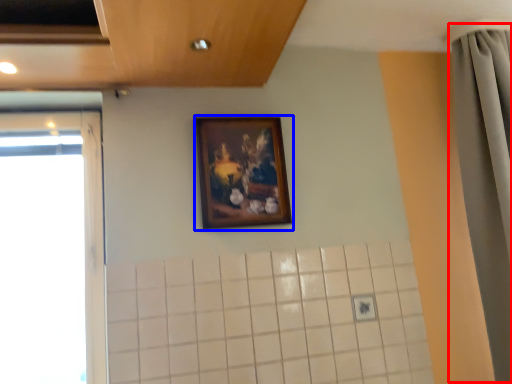
Question: Which of the following is the closest to the observer, shower curtain (highlighted by a red box) or picture frame (highlighted by a blue box)?

Choices:
 (A) shower curtain
 (B) picture frame

Answer: (A)